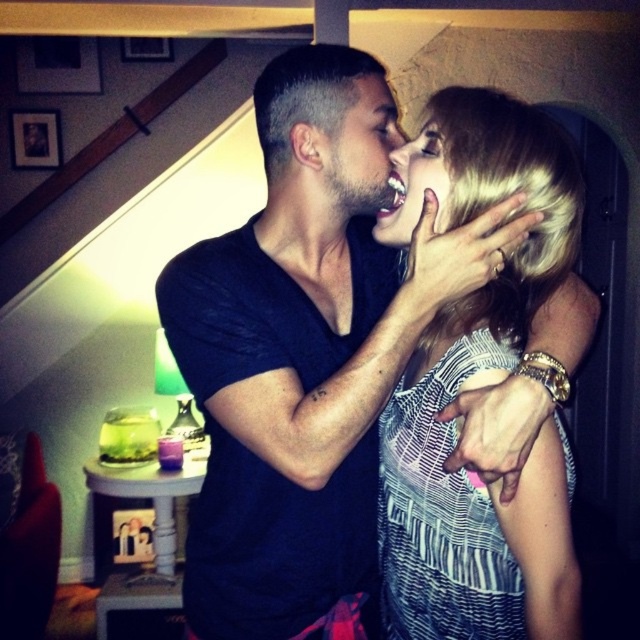
Question: Which object appears closest to the camera in this image?

Choices:
 (A) matte black beard at center
 (B) matte black shirt at center
 (C) striped fabric dress at center

Answer: (B)

Question: Which object appears closest to the camera in this image?

Choices:
 (A) matte skin face at center
 (B) matte black beard at center

Answer: (A)

Question: Is striped fabric dress at center smaller than matte skin face at center?

Choices:
 (A) yes
 (B) no

Answer: (B)

Question: Does matte black shirt at center appear on the right side of matte skin face at center?

Choices:
 (A) yes
 (B) no

Answer: (B)

Question: Which point is closer to the camera?

Choices:
 (A) matte black shirt at center
 (B) matte skin face at center

Answer: (A)

Question: Does matte black shirt at center appear over striped fabric dress at center?

Choices:
 (A) yes
 (B) no

Answer: (A)